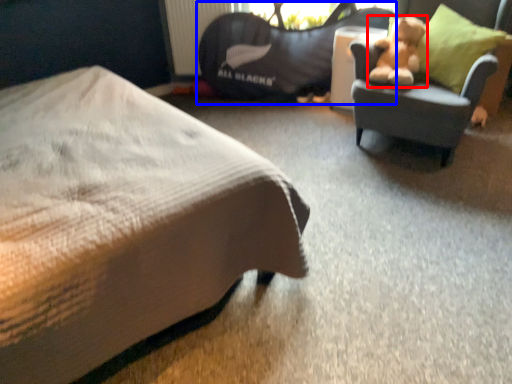
Question: Which object appears closest to the camera in this image, teddy bear (highlighted by a red box) or bean bag chair (highlighted by a blue box)?

Choices:
 (A) teddy bear
 (B) bean bag chair

Answer: (A)